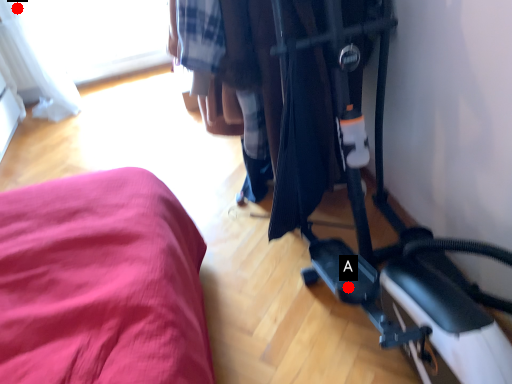
Question: Two points are circled on the image, labeled by A and B beside each circle. Which of the following is the closest to the observer?

Choices:
 (A) A is closer
 (B) B is closer

Answer: (A)